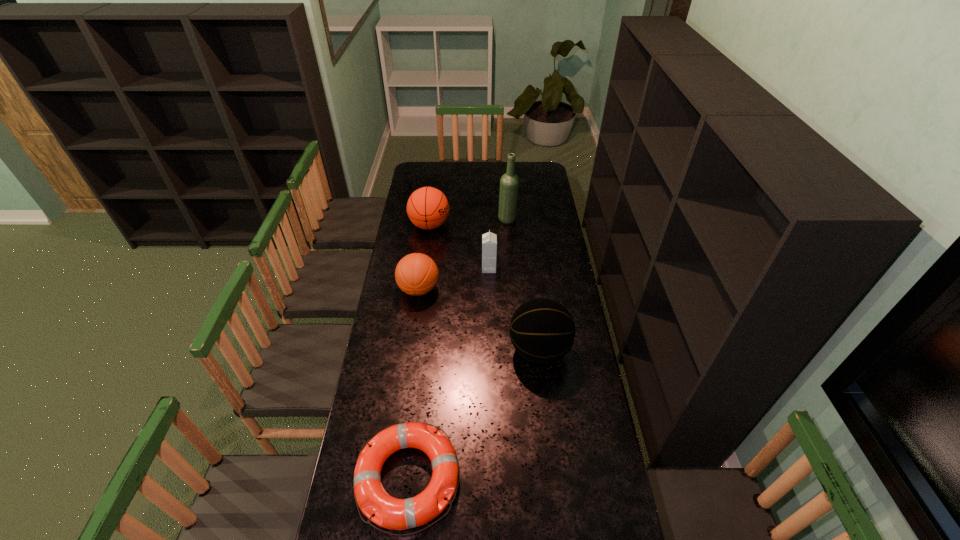
Where is `wine bottle`? This screenshot has width=960, height=540. wine bottle is located at coordinates (509, 183).

Identify the location of the nearest basketball. (542, 331).

The image size is (960, 540). I want to click on the rightmost basketball, so click(542, 331).

Where is `the farthest basketball`? the farthest basketball is located at coordinates (428, 208).

Locate an element on the screen. The height and width of the screenshot is (540, 960). the third object from right to left is located at coordinates (489, 240).

At what (x,y) coordinates should I click in order to perform the action: click on the fourth nearest object. Please return your answer as a coordinate pair (x, y). The image size is (960, 540). Looking at the image, I should click on tap(489, 240).

Where is `the second nearest basketball`? the second nearest basketball is located at coordinates (416, 274).

This screenshot has width=960, height=540. I want to click on the third nearest object, so click(416, 274).

Identify the location of life buoy. Image resolution: width=960 pixels, height=540 pixels. (392, 513).

Where is `the shortest object`? The height and width of the screenshot is (540, 960). the shortest object is located at coordinates 392,513.